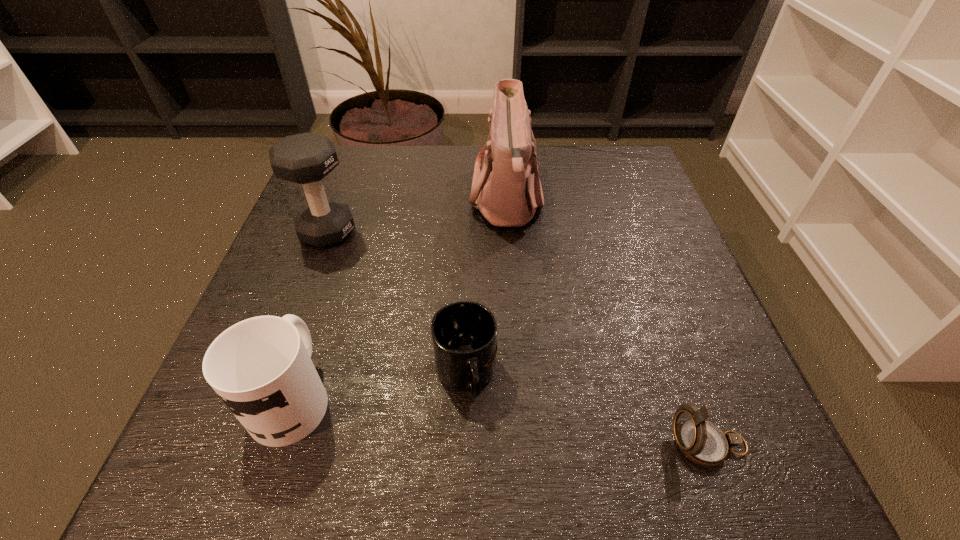
Where is `vacant area that lies between the shorter mug and the dumbbell`? vacant area that lies between the shorter mug and the dumbbell is located at coordinates (396, 303).

Locate an element on the screen. This screenshot has width=960, height=540. free space that is in between the third shortest object and the dumbbell is located at coordinates (310, 314).

You are a GUI agent. You are given a task and a screenshot of the screen. Output one action in this format:
    pyautogui.click(x=<x>, y=<y>)
    Task: Click on the vacant space that is in between the right mug and the left mug
    The width and height of the screenshot is (960, 540).
    Given the screenshot: What is the action you would take?
    pyautogui.click(x=379, y=386)

Identify the location of free spot between the rightmost object and the shoulder bag. (608, 322).

Identify the location of free space between the dumbbell and the rightmost object. (517, 338).

This screenshot has width=960, height=540. I want to click on vacant space that's between the rightmost object and the dumbbell, so click(x=517, y=338).

Locate an element on the screen. Image resolution: width=960 pixels, height=540 pixels. free area in between the taller mug and the compass is located at coordinates (500, 421).

This screenshot has width=960, height=540. What are the coordinates of `vacant point located between the rightmost object and the dumbbell` in the screenshot? It's located at click(x=517, y=338).

This screenshot has width=960, height=540. What are the coordinates of `vacant region between the taller mug and the shoulder bag` in the screenshot? It's located at (399, 298).

At what (x,y) coordinates should I click in order to perform the action: click on free point between the shoulder bag and the left mug. Please return your answer as a coordinate pair (x, y). Looking at the image, I should click on (399, 298).